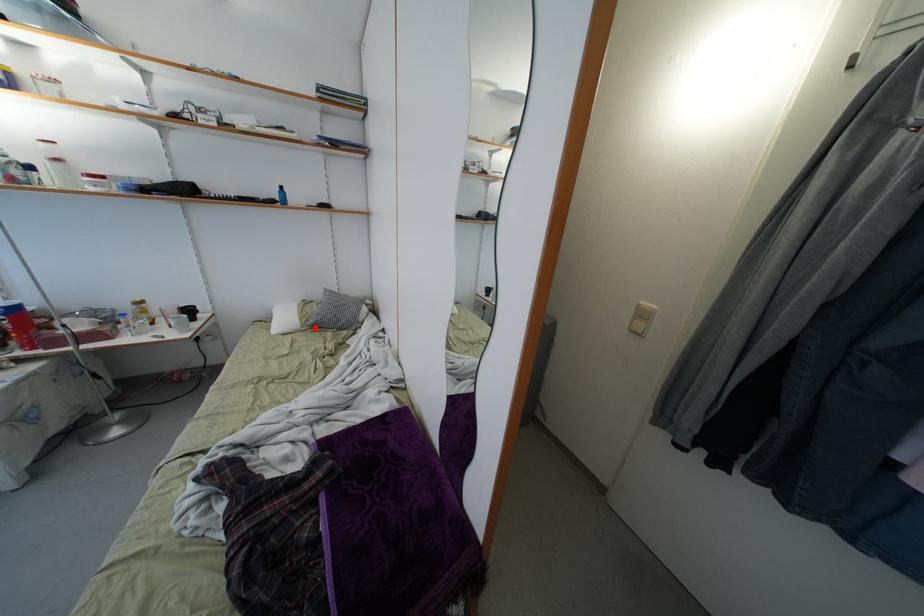
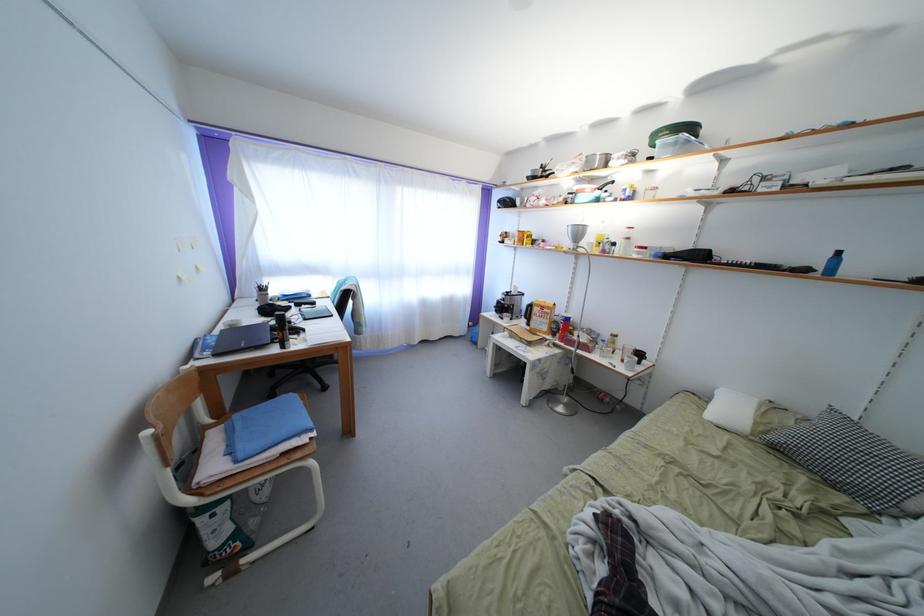
Where in the second image is the point corresponding to the highlighted location from the first image?

(779, 444)